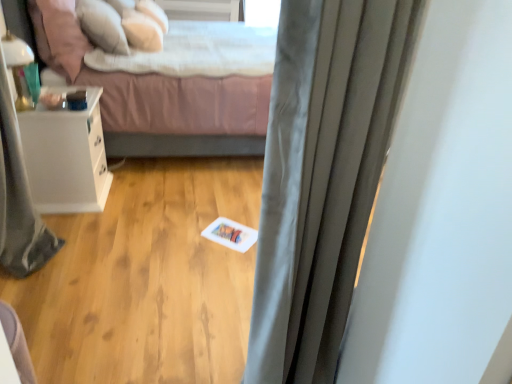
The height and width of the screenshot is (384, 512). Identify the location of unoccupied region to the right of gray fabric shower curtain at left. (92, 253).